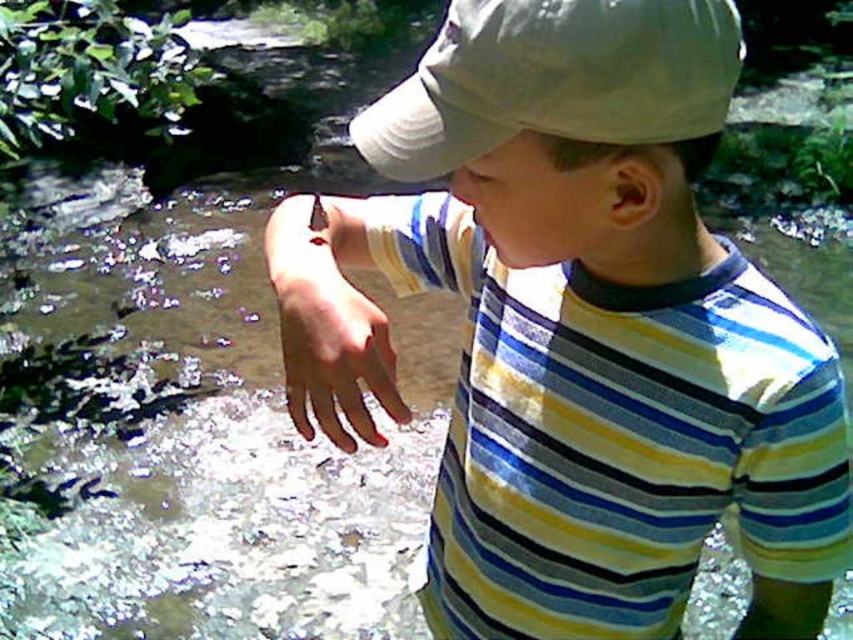
You are a photographer trying to capture the boy in the scene. To ensure both the matte striped shirt at center and the white fabric cap at upper center are clearly visible in your photo, which object should you focus on first considering their positions?

The white fabric cap at upper center should be focused on first because the matte striped shirt at center is to the right of it, meaning the cap is closer to the camera.